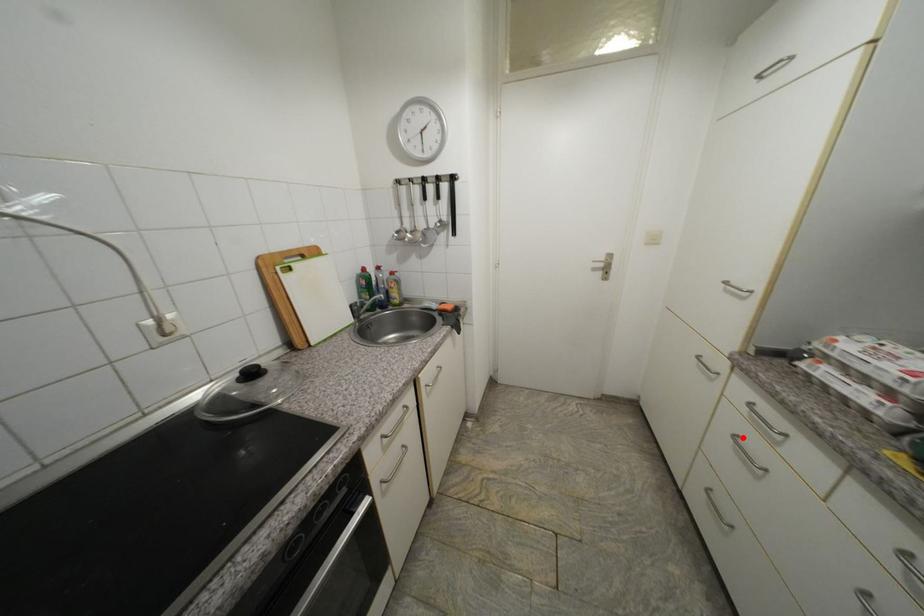
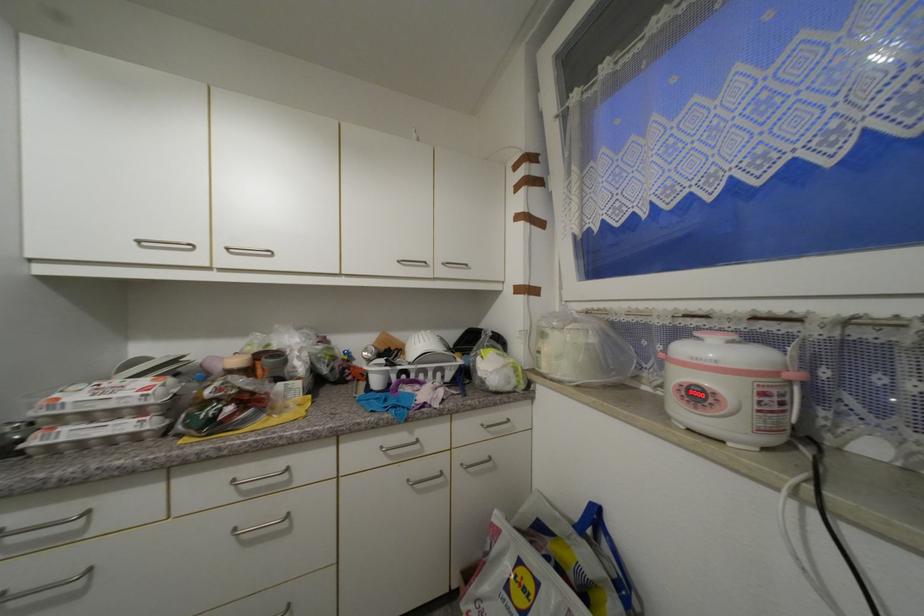
Question: I am providing you with two images of the same scene from different viewpoints. In image1, a red point is highlighted. Considering the same 3D point in image2, which of the following is correct?

Choices:
 (A) It is closer
 (B) It is farther

Answer: (A)